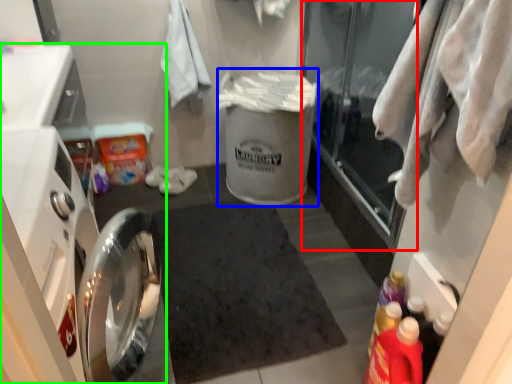
Question: Which object is the farthest from glass door (highlighted by a red box)? Choose among these: garbage (highlighted by a blue box) or dish washer (highlighted by a green box).

Choices:
 (A) garbage
 (B) dish washer

Answer: (B)